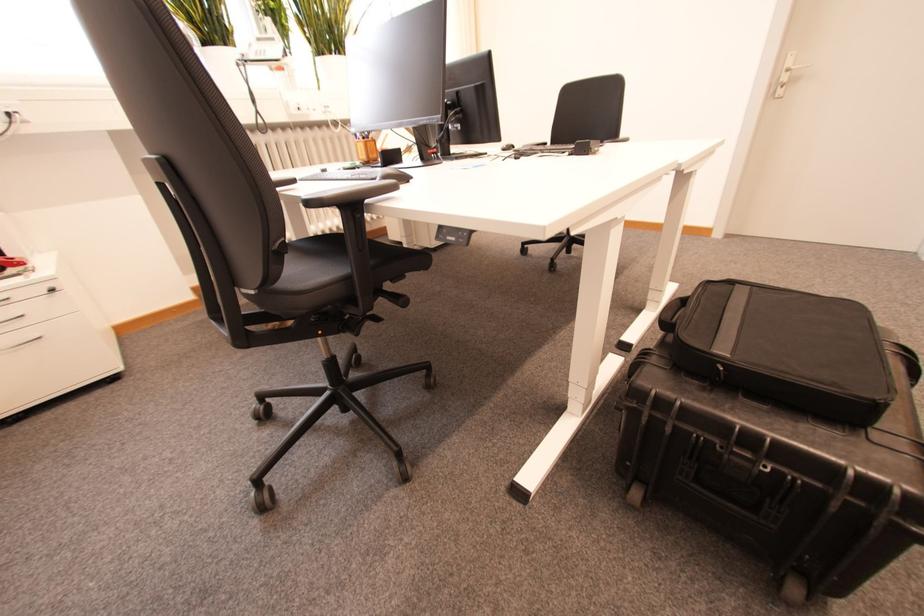
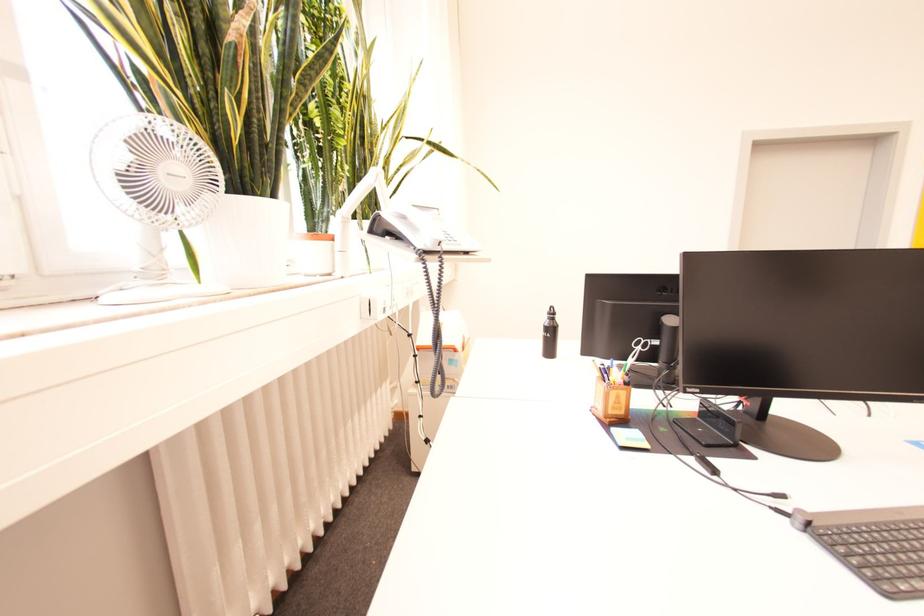
In the second image, find the point that corresponds to [368,148] in the first image.

(625, 398)